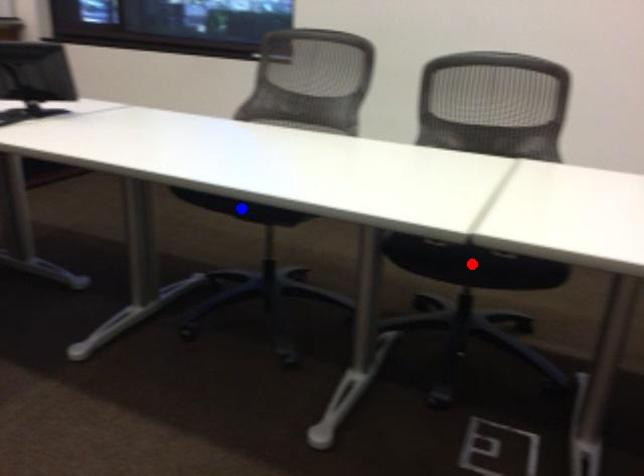
Question: In the image, two points are highlighted. Which point is nearer to the camera? Reply with the corresponding letter.

Choices:
 (A) blue point
 (B) red point

Answer: (B)